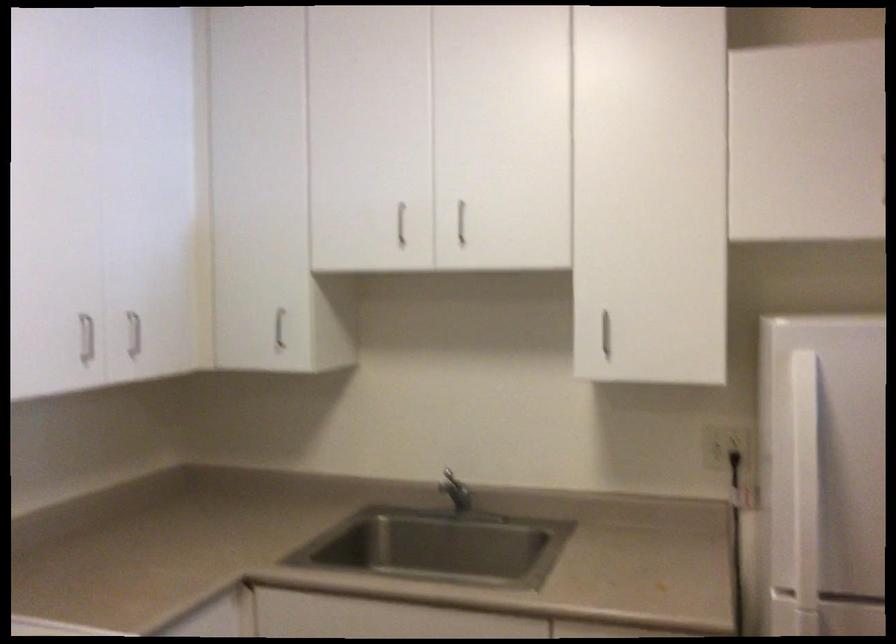
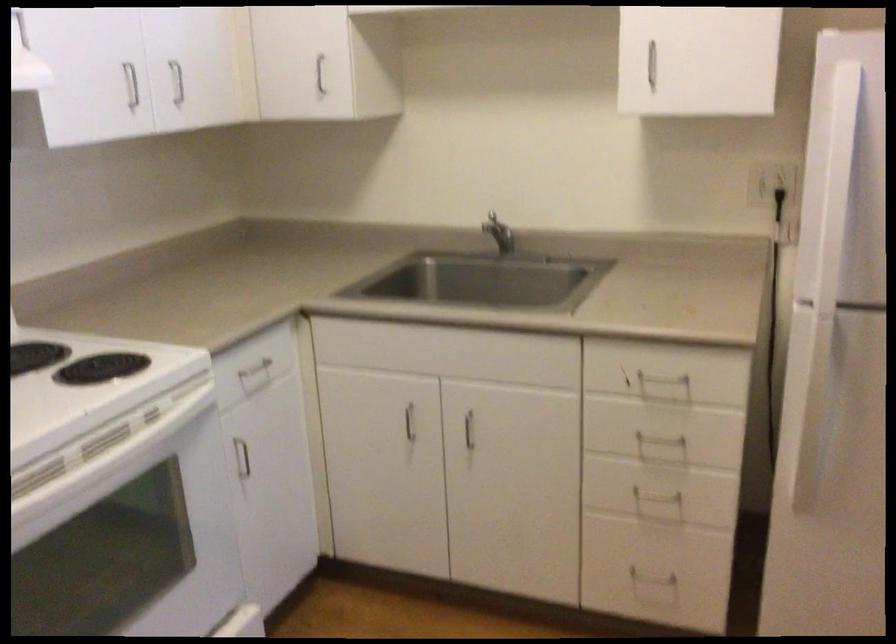
Question: The first image is from the beginning of the video and the second image is from the end. How did the camera likely rotate when shooting the video?

Choices:
 (A) Left
 (B) Right
 (C) Up
 (D) Down

Answer: (D)